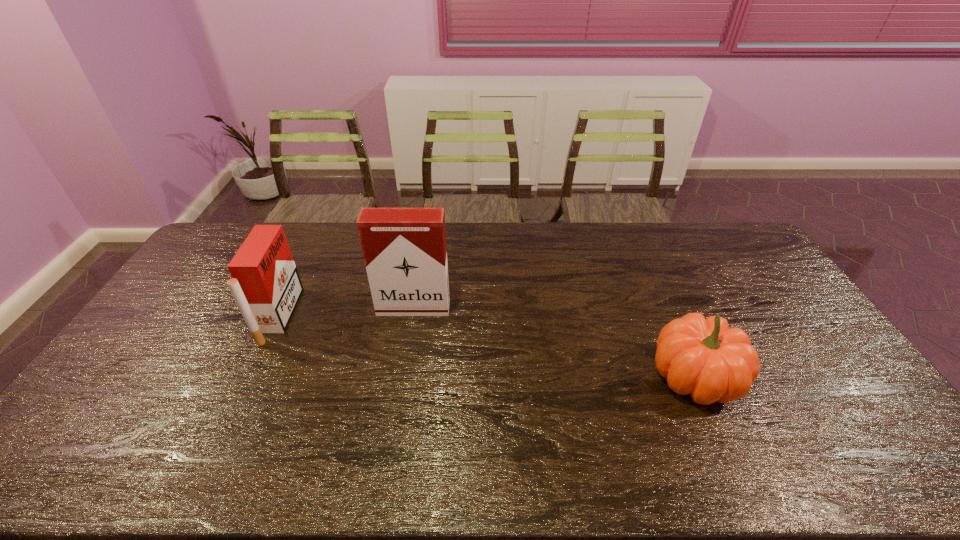
Locate an element on the screen. The image size is (960, 540). vacant region at the near edge of the desktop is located at coordinates (565, 447).

This screenshot has height=540, width=960. What are the coordinates of `free location at the left edge` in the screenshot? It's located at (156, 381).

Find the location of `free space at the right edge`. free space at the right edge is located at coordinates (723, 264).

Locate an element on the screen. This screenshot has width=960, height=540. free space at the near left corner of the desktop is located at coordinates (42, 473).

Find the location of a particular element. The image size is (960, 540). unoccupied position between the left cigarette case and the rightmost object is located at coordinates (487, 346).

In order to click on free spot between the shortest object and the left cigarette case in this screenshot , I will do `click(487, 346)`.

Locate an element on the screen. free space that is in between the pumpkin and the right cigarette case is located at coordinates (554, 342).

Locate an element on the screen. unoccupied position between the left cigarette case and the second object from left to right is located at coordinates (347, 312).

The height and width of the screenshot is (540, 960). Identify the location of free point between the shortest object and the leftmost object. (487, 346).

Image resolution: width=960 pixels, height=540 pixels. What are the coordinates of `free space between the pumpkin and the leftmost object` in the screenshot? It's located at (487, 346).